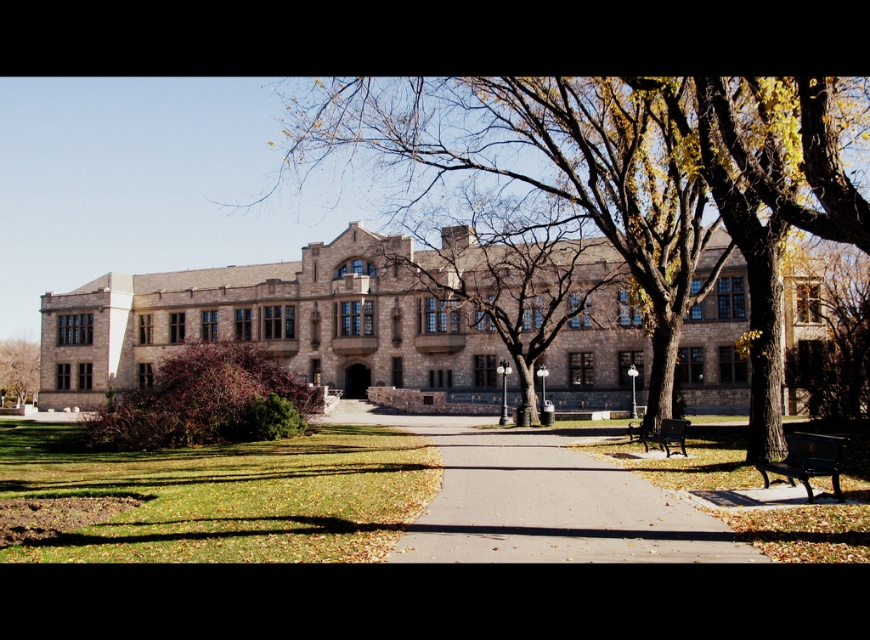
Is brown textured tree at center to the left of brown textured bush at left from the viewer's perspective?

Incorrect, brown textured tree at center is not on the left side of brown textured bush at left.

Who is more forward, (x=664, y=99) or (x=182, y=420)?

Point (x=664, y=99) is in front.

Identify the location of brown textured tree at center. (632, 173).

The width and height of the screenshot is (870, 640). Identify the location of brown textured tree at center. (632, 173).

Can you confirm if brown textured bush at left is wider than brown textured tree at left?

No, brown textured bush at left is not wider than brown textured tree at left.

Locate an element on the screen. Image resolution: width=870 pixels, height=640 pixels. brown textured bush at left is located at coordinates (205, 401).

Does point (241, 410) come behind point (3, 356)?

No, it is in front of (3, 356).

At what (x,y) coordinates should I click in order to perform the action: click on brown textured bush at left. Please return your answer as a coordinate pair (x, y). Looking at the image, I should click on (205, 401).

Which is in front, point (503, 150) or point (547, 284)?

Point (547, 284) is in front.

Can you confirm if brown textured tree at center is positioned to the right of brown stone tree at center?

Indeed, brown textured tree at center is positioned on the right side of brown stone tree at center.

Does point (591, 99) lie behind point (554, 262)?

No, it is not.

Locate an element on the screen. Image resolution: width=870 pixels, height=640 pixels. brown textured tree at center is located at coordinates (632, 173).